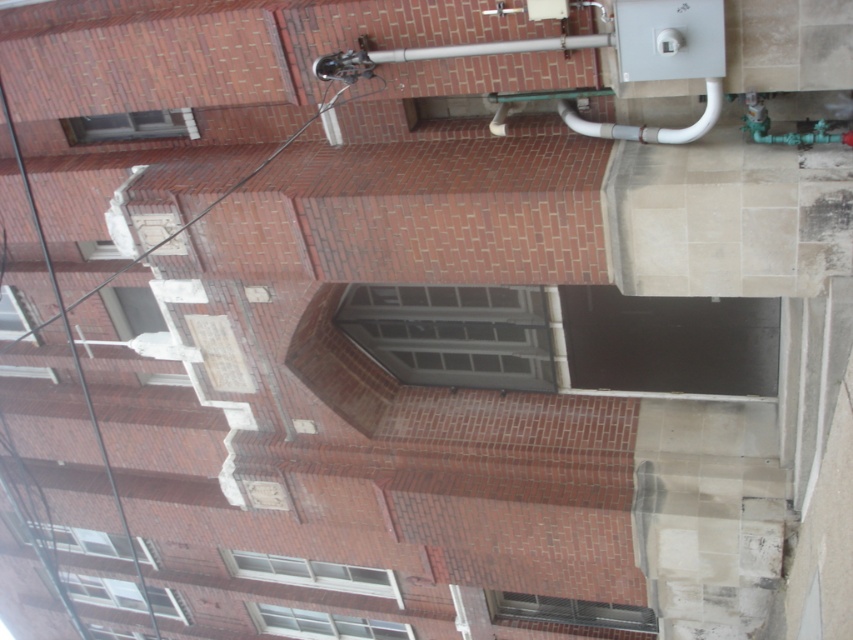
Question: Is silver metallic pipe at upper center thinner than white glossy pipe at upper right?

Choices:
 (A) no
 (B) yes

Answer: (A)

Question: Which of the following is the closest to the observer?

Choices:
 (A) silver metallic pipe at upper center
 (B) white glossy pipe at upper right

Answer: (A)

Question: Is silver metallic pipe at upper center thinner than white glossy pipe at upper right?

Choices:
 (A) no
 (B) yes

Answer: (A)

Question: Among these objects, which one is farthest from the camera?

Choices:
 (A) white glossy pipe at upper right
 (B) silver metallic pipe at upper center

Answer: (A)

Question: Can you confirm if silver metallic pipe at upper center is bigger than white glossy pipe at upper right?

Choices:
 (A) yes
 (B) no

Answer: (B)

Question: Which object appears closest to the camera in this image?

Choices:
 (A) silver metallic pipe at upper center
 (B) white glossy pipe at upper right

Answer: (A)